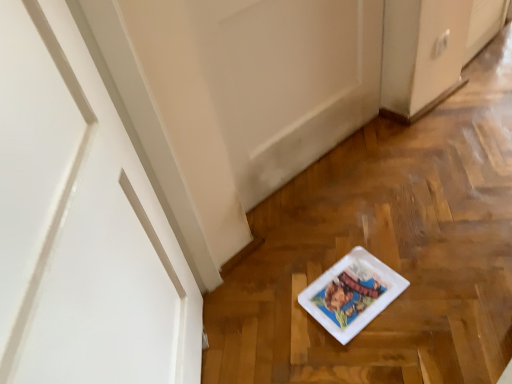
Identify the location of white glossy platter at center. The image size is (512, 384). (352, 293).

This screenshot has width=512, height=384. What do you see at coordinates (352, 293) in the screenshot? I see `white glossy platter at center` at bounding box center [352, 293].

Describe the element at coordinates (81, 224) in the screenshot. The height and width of the screenshot is (384, 512). I see `white matte door at center` at that location.

At what (x,y) coordinates should I click in order to perform the action: click on white matte door at center. Please return your answer as a coordinate pair (x, y). Image resolution: width=512 pixels, height=384 pixels. Looking at the image, I should click on (81, 224).

What is the approximate width of white matte door at center?

white matte door at center is 6.07 inches wide.

Measure the distance between white matte door at center and camera.

17.41 inches.

Where is `white glossy platter at center`? This screenshot has width=512, height=384. white glossy platter at center is located at coordinates (352, 293).

Which is more to the right, white matte door at center or white glossy platter at center?

white glossy platter at center is more to the right.

In the scene shown: Is white matte door at center further to the viewer compared to white glossy platter at center?

That is False.

Does point (120, 149) lie behind point (318, 299)?

No.

Based on the photo, from the image's perspective, is white matte door at center above or below white glossy platter at center?

white matte door at center is above white glossy platter at center.

From a real-world perspective, who is located higher, white matte door at center or white glossy platter at center?

white matte door at center is physically above.

Consider the image. Considering the sizes of objects white matte door at center and white glossy platter at center in the image provided, who is thinner, white matte door at center or white glossy platter at center?

Thinner between the two is white matte door at center.

Between white matte door at center and white glossy platter at center, which one has less height?

Standing shorter between the two is white glossy platter at center.

Is white matte door at center bigger or smaller than white glossy platter at center?

In the image, white matte door at center appears to be larger than white glossy platter at center.

Would you say white matte door at center is inside or outside white glossy platter at center?

white matte door at center is located beyond the bounds of white glossy platter at center.

Is white matte door at center beside white glossy platter at center?

No, white matte door at center is not in contact with white glossy platter at center.

Is white matte door at center oriented towards white glossy platter at center?

Yes, white matte door at center is aimed at white glossy platter at center.

How much distance is there between white matte door at center and white glossy platter at center?

white matte door at center and white glossy platter at center are 27.97 inches apart from each other.

The image size is (512, 384). In order to click on platter that is under the white matte door at center (from a real-world perspective) in this screenshot , I will do `click(352, 293)`.

Is white glossy platter at center to the right of white matte door at center from the viewer's perspective?

Yes, white glossy platter at center is to the right of white matte door at center.

Does white glossy platter at center lie behind white matte door at center?

That is True.

Does point (367, 314) come farther from viewer compared to point (113, 376)?

Yes, it is.

From the image's perspective, is white glossy platter at center positioned above or below white matte door at center?

white glossy platter at center is situated lower than white matte door at center in the image.

Looking at this image, from a real-world perspective, who is located higher, white glossy platter at center or white matte door at center?

In real-world perspective, white matte door at center is above.

Can you confirm if white glossy platter at center is wider than white matte door at center?

Correct, the width of white glossy platter at center exceeds that of white matte door at center.

In terms of height, does white glossy platter at center look taller or shorter compared to white matte door at center?

Clearly, white glossy platter at center is shorter compared to white matte door at center.

Who is bigger, white glossy platter at center or white matte door at center?

With larger size is white matte door at center.

Is white glossy platter at center inside the boundaries of white matte door at center, or outside?

white glossy platter at center cannot be found inside white matte door at center.

Is white glossy platter at center placed right next to white matte door at center?

They are not placed beside each other.

Could you tell me if white glossy platter at center is turned towards white matte door at center?

No, white glossy platter at center does not turn towards white matte door at center.

What's the angular difference between white glossy platter at center and white matte door at center's facing directions?

37.2 degrees.

How far apart are white glossy platter at center and white matte door at center?

27.97 inches.

Identify the location of platter that is behind the white matte door at center. (352, 293).

Find the location of `door that appears in front of the white glossy platter at center`. door that appears in front of the white glossy platter at center is located at coordinates (81, 224).

Identify the location of door above the white glossy platter at center (from the image's perspective). (x=81, y=224).